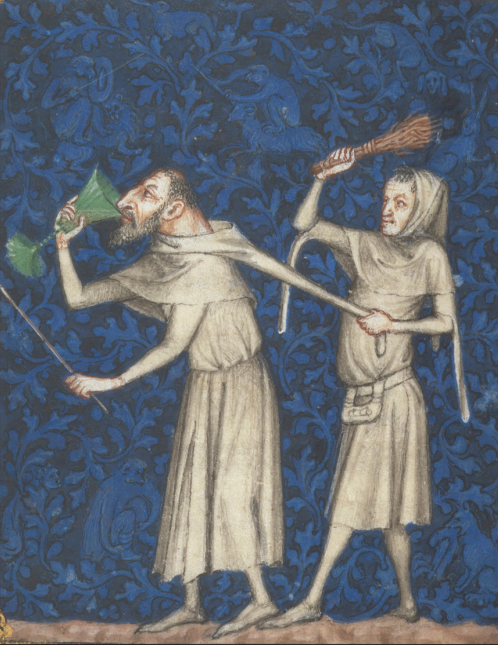
The height and width of the screenshot is (645, 498). I want to click on large green glass, so click(x=99, y=203).